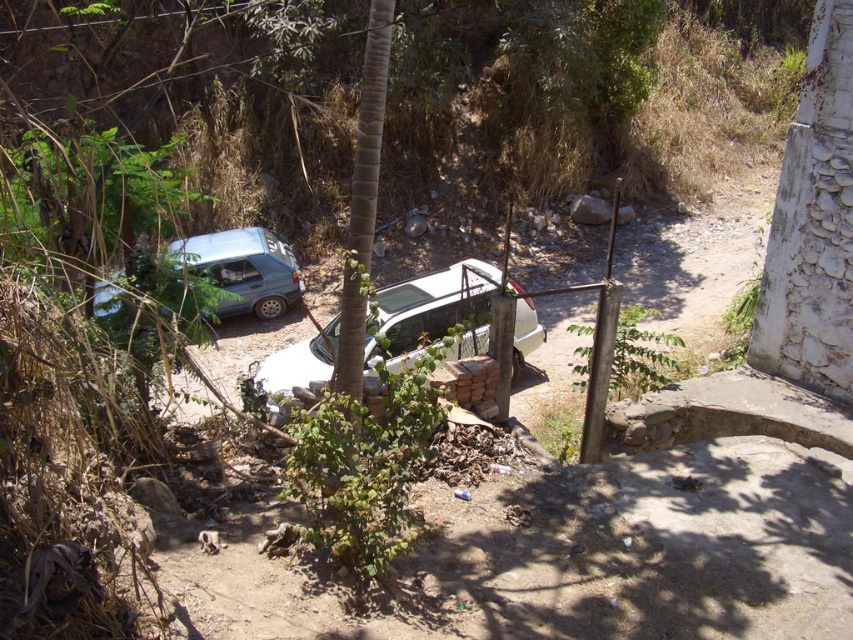
Is green textured tree at center in front of matte blue car at left?

Yes, green textured tree at center is closer to the viewer.

Can you confirm if green textured tree at center is positioned above matte blue car at left?

Incorrect, green textured tree at center is not positioned above matte blue car at left.

What are the coordinates of `green textured tree at center` in the screenshot? It's located at (363, 200).

Identify the location of white matte car at center. Image resolution: width=853 pixels, height=640 pixels. (436, 310).

Does white matte car at center come in front of matte blue car at left?

No, it is not.

Which is behind, point (454, 301) or point (271, 268)?

Point (271, 268)

Locate an element on the screen. white matte car at center is located at coordinates (436, 310).

Looking at this image, is white matte car at center wider than green textured tree at center?

Indeed, white matte car at center has a greater width compared to green textured tree at center.

Is white matte car at center further to the viewer compared to green textured tree at center?

Yes, white matte car at center is behind green textured tree at center.

Does point (257, 390) lie in front of point (341, 292)?

Yes, point (257, 390) is closer to viewer.

This screenshot has height=640, width=853. In order to click on white matte car at center in this screenshot , I will do `click(436, 310)`.